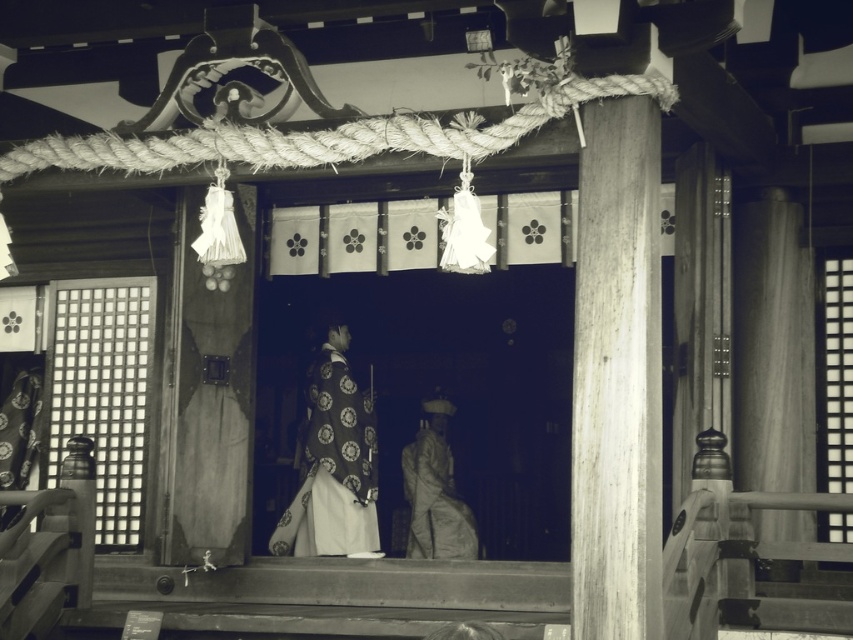
Is silky white kimono at center bigger than silky gray robe at center?

Indeed, silky white kimono at center has a larger size compared to silky gray robe at center.

Is silky white kimono at center further to camera compared to silky gray robe at center?

No, silky white kimono at center is closer to the viewer.

Is point (325, 392) farther from viewer compared to point (415, 465)?

No.

Where is `silky white kimono at center`? silky white kimono at center is located at coordinates (334, 468).